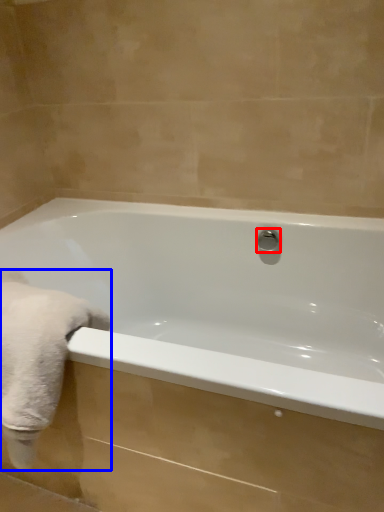
Question: Which of the following is the farthest to the observer, shower (highlighted by a red box) or bath towel (highlighted by a blue box)?

Choices:
 (A) shower
 (B) bath towel

Answer: (A)